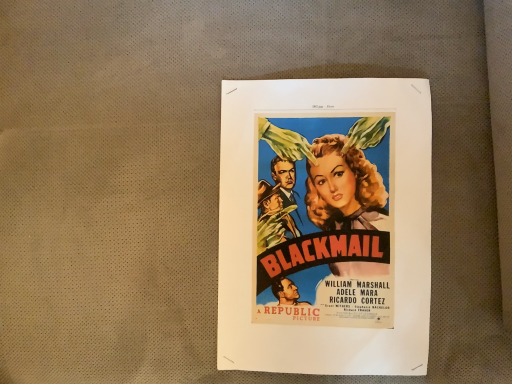
What do you see at coordinates (325, 226) in the screenshot?
I see `vibrant paper poster at center` at bounding box center [325, 226].

Identify the location of vibrant paper poster at center. (325, 226).

You are a GUI agent. You are given a task and a screenshot of the screen. Output one action in this format:
    pyautogui.click(x=<x>, y=<y>)
    Task: Click on the vibrant paper poster at center
    The image size is (512, 384).
    Given the screenshot: What is the action you would take?
    325,226